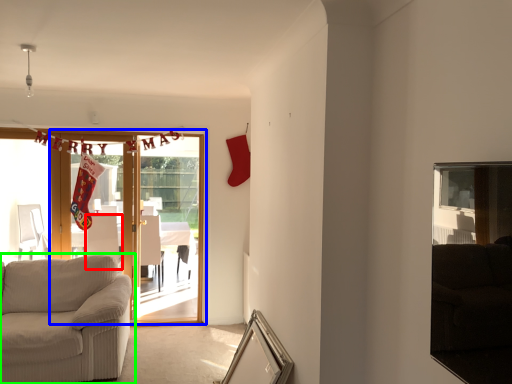
Question: Based on their relative distances, which object is farther from armchair (highlighted by a red box)? Choose from door (highlighted by a blue box) and studio couch (highlighted by a green box).

Choices:
 (A) door
 (B) studio couch

Answer: (B)